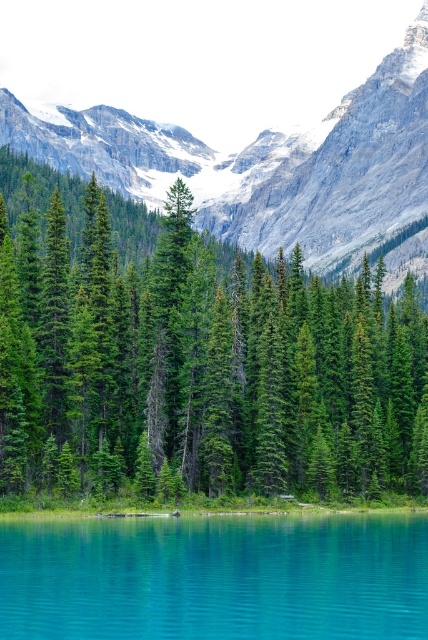
Question: Is green matte pine forest at center closer to camera compared to rocky gray mountain at upper center?

Choices:
 (A) yes
 (B) no

Answer: (A)

Question: Which object is positioned farthest from the green matte pine forest at center?

Choices:
 (A) rocky gray mountain at upper center
 (B) turquoise glassy water at lower center

Answer: (A)

Question: Can you confirm if green matte pine forest at center is positioned to the right of rocky gray mountain at upper center?

Choices:
 (A) yes
 (B) no

Answer: (B)

Question: Among these objects, which one is farthest from the camera?

Choices:
 (A) turquoise glassy water at lower center
 (B) rocky gray mountain at upper center

Answer: (B)

Question: Does rocky gray mountain at upper center have a larger size compared to turquoise glassy water at lower center?

Choices:
 (A) no
 (B) yes

Answer: (B)

Question: Which of the following is the farthest from the observer?

Choices:
 (A) green matte pine forest at center
 (B) turquoise glassy water at lower center
 (C) rocky gray mountain at upper center

Answer: (C)